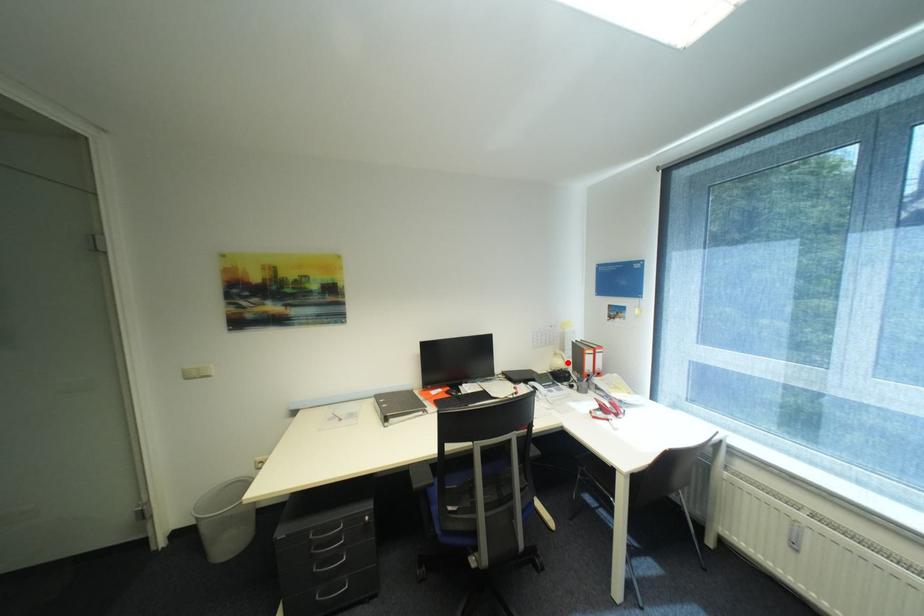
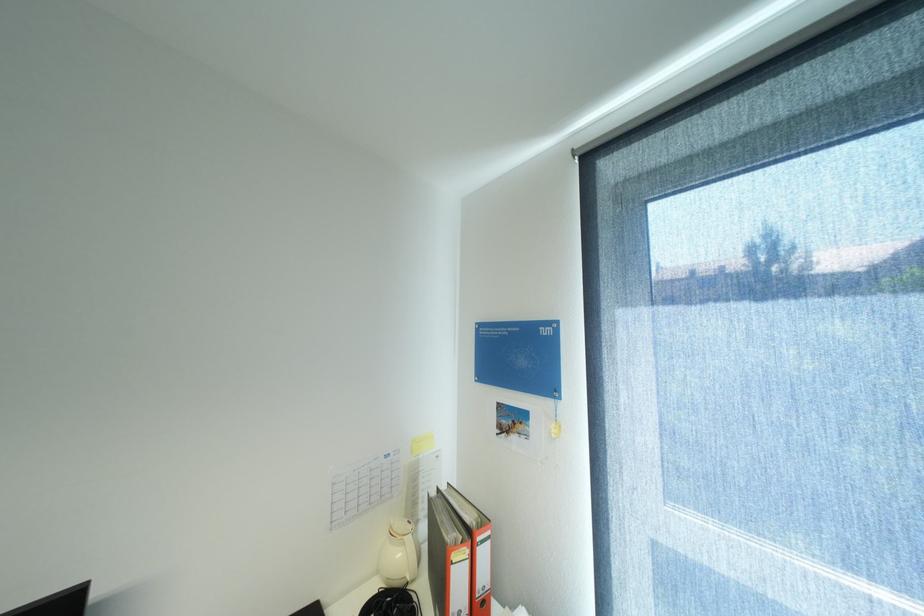
The point at the highlighted location is marked in the first image. Where is the corresponding point in the second image?

(407, 554)